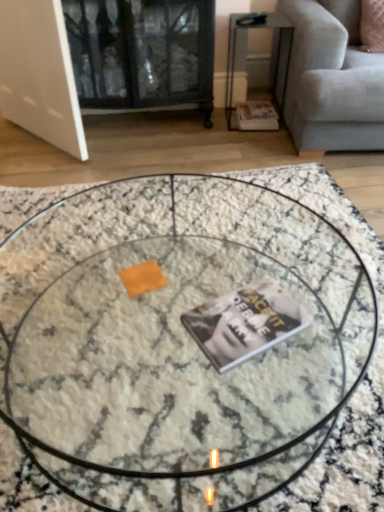
Find the location of `light gray fabric couch at upper right`. light gray fabric couch at upper right is located at coordinates (332, 79).

What do you see at coordinates (256, 116) in the screenshot?
I see `matte paper magazine at lower right, the first magazine positioned from the right` at bounding box center [256, 116].

Measure the distance between metallic silver side table at upper right and camera.

The depth of metallic silver side table at upper right is 6.95 feet.

You are a GUI agent. You are given a task and a screenshot of the screen. Output one action in this format:
    pyautogui.click(x=<x>, y=<y>)
    Task: Click on the hardcover book at center, the second magazine in the back-to-front sequence
    Image resolution: width=384 pixels, height=512 pixels.
    Given the screenshot: What is the action you would take?
    pyautogui.click(x=244, y=322)

At what (x,y) coordinates should I click in order to perform the action: click on light gray fabric couch at upper right. Please return your answer as a coordinate pair (x, y). Looking at the image, I should click on (332, 79).

From a real-world perspective, relative to marble textured coffee table at center, is metallic silver side table at upper right vertically above or below?

In terms of real-world spatial position, metallic silver side table at upper right is above marble textured coffee table at center.

Is point (243, 25) closer to viewer compared to point (37, 430)?

No, it is not.

Can you tell me how much metallic silver side table at upper right and marble textured coffee table at center differ in facing direction?

The angle between the facing direction of metallic silver side table at upper right and the facing direction of marble textured coffee table at center is 173 degrees.

From a real-world perspective, which is physically below, metallic silver side table at upper right or hardcover book at center, arranged as the second magazine when viewed from the right?

From a 3D spatial view, metallic silver side table at upper right is below.

Is metallic silver side table at upper right turned away from hardcover book at center, the 1th magazine from the left?

No, hardcover book at center, the 1th magazine from the left, is not at the back of metallic silver side table at upper right.

Which object is closer to the camera, metallic silver side table at upper right or hardcover book at center, the second magazine in the back-to-front sequence?

hardcover book at center, the second magazine in the back-to-front sequence, is closer to the camera.

Based on their positions, is metallic silver side table at upper right located to the left or right of hardcover book at center, the 1th magazine from the left?

In the image, metallic silver side table at upper right appears on the right side of hardcover book at center, the 1th magazine from the left.

Which of these two, matte paper magazine at lower right, marked as the 2th magazine in a front-to-back arrangement, or metallic silver side table at upper right, is smaller?

With smaller size is matte paper magazine at lower right, marked as the 2th magazine in a front-to-back arrangement.

Is matte paper magazine at lower right, the 2th magazine from the left, inside or outside of metallic silver side table at upper right?

matte paper magazine at lower right, the 2th magazine from the left, is inside metallic silver side table at upper right.

From their relative heights in the image, would you say matte paper magazine at lower right, the 2th magazine from the left, is taller or shorter than metallic silver side table at upper right?

matte paper magazine at lower right, the 2th magazine from the left, is shorter than metallic silver side table at upper right.

From the image's perspective, is matte paper magazine at lower right, the 2th magazine from the left, positioned above or below metallic silver side table at upper right?

Based on their image positions, matte paper magazine at lower right, the 2th magazine from the left, is located beneath metallic silver side table at upper right.

Is marble textured coffee table at center oriented towards hardcover book at center, which is the first magazine from bottom to top?

No, marble textured coffee table at center is not facing towards hardcover book at center, which is the first magazine from bottom to top.

From a real-world perspective, is marble textured coffee table at center over hardcover book at center, positioned as the first magazine in front-to-back order?

No, from a real-world perspective, marble textured coffee table at center is not on top of hardcover book at center, positioned as the first magazine in front-to-back order.

I want to click on coffee table that is on the left side of hardcover book at center, which is the first magazine from bottom to top, so click(x=173, y=323).

In the scene shown: Which object is closer to the camera taking this photo, marble textured coffee table at center or hardcover book at center, which is the first magazine from bottom to top?

marble textured coffee table at center is more forward.

From a real-world perspective, which object rests below the other?

matte paper magazine at lower right, which appears as the 1th magazine when viewed from the back, is physically lower.

What's the angular difference between metallic silver side table at upper right and matte paper magazine at lower right, the 2th magazine from the left,'s facing directions?

metallic silver side table at upper right and matte paper magazine at lower right, the 2th magazine from the left, are facing 1.09 degrees away from each other.

The height and width of the screenshot is (512, 384). What are the coordinates of `magazine behind the metallic silver side table at upper right` in the screenshot? It's located at (256, 116).

Do you think metallic silver side table at upper right is within matte paper magazine at lower right, the first magazine positioned from the right, or outside of it?

metallic silver side table at upper right is not inside matte paper magazine at lower right, the first magazine positioned from the right, it's outside.

At what (x,y) coordinates should I click in order to perform the action: click on studio couch located above the marble textured coffee table at center (from a real-world perspective). Please return your answer as a coordinate pair (x, y). This screenshot has width=384, height=512. Looking at the image, I should click on (332, 79).

Considering their positions, is light gray fabric couch at upper right located in front of or behind marble textured coffee table at center?

light gray fabric couch at upper right is positioned farther from the viewer than marble textured coffee table at center.

Is light gray fabric couch at upper right placed right next to marble textured coffee table at center?

No, light gray fabric couch at upper right is not with marble textured coffee table at center.

Is light gray fabric couch at upper right looking in the opposite direction of metallic silver side table at upper right?

No, light gray fabric couch at upper right's orientation is not away from metallic silver side table at upper right.

From a real-world perspective, which object stands above the other?

From a 3D spatial view, light gray fabric couch at upper right is above.

Is light gray fabric couch at upper right positioned before metallic silver side table at upper right?

Yes.

Where is `studio couch on the right of metallic silver side table at upper right`? This screenshot has height=512, width=384. studio couch on the right of metallic silver side table at upper right is located at coordinates (332, 79).

Locate an element on the screen. coffee table in front of the metallic silver side table at upper right is located at coordinates (173, 323).

This screenshot has width=384, height=512. I want to click on side table directly beneath the hardcover book at center, the 1th magazine from the left (from a real-world perspective), so click(x=277, y=52).

Looking at the image, which one is located closer to light gray fabric couch at upper right, metallic silver side table at upper right or marble textured coffee table at center?

metallic silver side table at upper right is closer to light gray fabric couch at upper right.

Looking at the image, which one is located closer to matte paper magazine at lower right, marked as the 2th magazine in a front-to-back arrangement, metallic silver side table at upper right or hardcover book at center, positioned as the first magazine in front-to-back order?

Among the two, metallic silver side table at upper right is located nearer to matte paper magazine at lower right, marked as the 2th magazine in a front-to-back arrangement.

When comparing their distances from marble textured coffee table at center, does hardcover book at center, the second magazine in the back-to-front sequence, or metallic silver side table at upper right seem further?

Among the two, metallic silver side table at upper right is located further to marble textured coffee table at center.

From the image, which object appears to be farther from metallic silver side table at upper right, matte paper magazine at lower right, marked as the 2th magazine in a front-to-back arrangement, or light gray fabric couch at upper right?

Among the two, light gray fabric couch at upper right is located further to metallic silver side table at upper right.

When comparing their distances from metallic silver side table at upper right, does hardcover book at center, the 1th magazine from the left, or marble textured coffee table at center seem further?

→ The object further to metallic silver side table at upper right is hardcover book at center, the 1th magazine from the left.

Based on their spatial positions, is light gray fabric couch at upper right or metallic silver side table at upper right further from matte paper magazine at lower right, the 1th magazine in the top-to-bottom sequence?

light gray fabric couch at upper right lies further to matte paper magazine at lower right, the 1th magazine in the top-to-bottom sequence, than the other object.

Which object lies nearer to the anchor point marble textured coffee table at center, metallic silver side table at upper right or hardcover book at center, arranged as the second magazine when viewed from the right?

Among the two, hardcover book at center, arranged as the second magazine when viewed from the right, is located nearer to marble textured coffee table at center.

Consider the image. Estimate the real-world distances between objects in this image. Which object is closer to marble textured coffee table at center, light gray fabric couch at upper right or hardcover book at center, which is the first magazine from bottom to top?

hardcover book at center, which is the first magazine from bottom to top, is positioned closer to the anchor marble textured coffee table at center.

You are a GUI agent. You are given a task and a screenshot of the screen. Output one action in this format:
    pyautogui.click(x=<x>, y=<y>)
    Task: Click on the magazine between marble textured coffee table at center and metallic silver side table at upper right in the front-back direction
    The width and height of the screenshot is (384, 512).
    Given the screenshot: What is the action you would take?
    pyautogui.click(x=244, y=322)

At what (x,y) coordinates should I click in order to perform the action: click on studio couch between marble textured coffee table at center and matte paper magazine at lower right, the first magazine positioned from the right, from front to back. Please return your answer as a coordinate pair (x, y). Looking at the image, I should click on (332, 79).

Locate an element on the screen. The image size is (384, 512). coffee table between light gray fabric couch at upper right and hardcover book at center, which is the first magazine from bottom to top, in the up-down direction is located at coordinates (173, 323).

The height and width of the screenshot is (512, 384). What are the coordinates of `side table that lies between light gray fabric couch at upper right and hardcover book at center, positioned as the first magazine in front-to-back order, from top to bottom` in the screenshot? It's located at (277, 52).